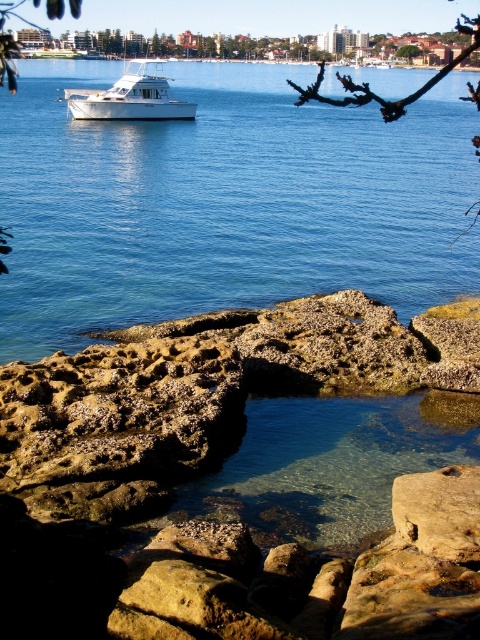
Does point (442, 550) come in front of point (404, 56)?

Yes, point (442, 550) is in front of point (404, 56).

Identify the location of brown rough rock at lower right. (440, 512).

Can you confirm if clear water at center is thinner than brown rough rock at lower right?

No, clear water at center is not thinner than brown rough rock at lower right.

Does clear water at center have a larger size compared to brown rough rock at lower right?

Yes.

Locate an element on the screen. This screenshot has height=640, width=480. clear water at center is located at coordinates (225, 202).

You are a GUI agent. You are given a task and a screenshot of the screen. Output one action in this format:
    pyautogui.click(x=<x>, y=<y>)
    Task: Click on the clear water at center
    This screenshot has height=640, width=480.
    Given the screenshot: What is the action you would take?
    pyautogui.click(x=225, y=202)

Is clear water at center in front of white matte boat at upper left?

That is True.

Which is behind, point (33, 84) or point (158, 93)?

Point (33, 84)

The image size is (480, 640). Identify the location of clear water at center. (225, 202).